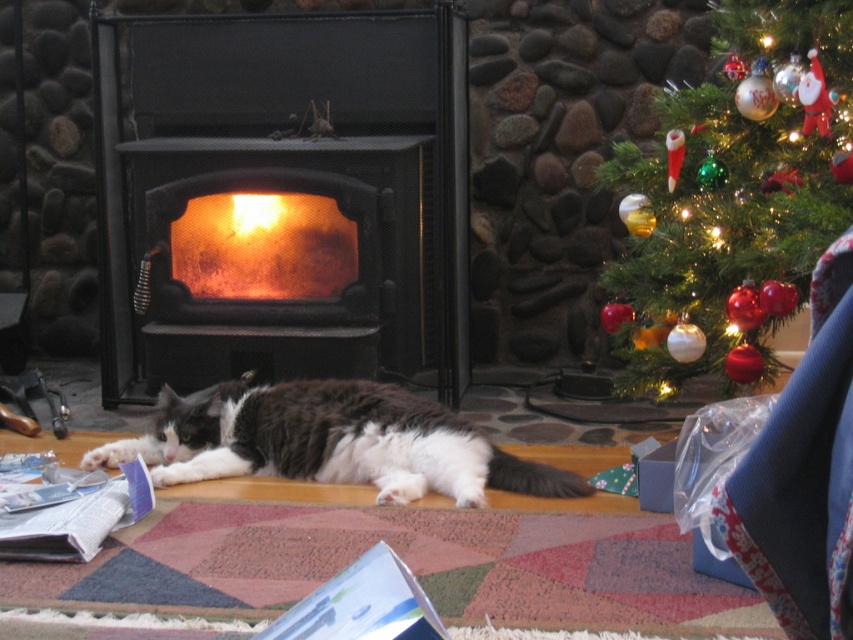
Question: Where is black matte fireplace at center located in relation to shiny glass ornaments at upper right in the image?

Choices:
 (A) below
 (B) above

Answer: (B)

Question: Can you confirm if black matte fireplace at center is wider than fluffy white and gray cat at center?

Choices:
 (A) no
 (B) yes

Answer: (A)

Question: Which object is the farthest from the orange glassy fire at center?

Choices:
 (A) shiny glass ornaments at upper right
 (B) fluffy white and gray cat at center
 (C) black matte fireplace at center

Answer: (A)

Question: Can you confirm if fluffy white and gray cat at center is positioned above orange glassy fire at center?

Choices:
 (A) yes
 (B) no

Answer: (B)

Question: Which object appears farthest from the camera in this image?

Choices:
 (A) shiny glass ornaments at upper right
 (B) black matte fireplace at center
 (C) orange glassy fire at center

Answer: (C)

Question: Which object is positioned farthest from the fluffy white and gray cat at center?

Choices:
 (A) orange glassy fire at center
 (B) shiny glass ornaments at upper right

Answer: (B)